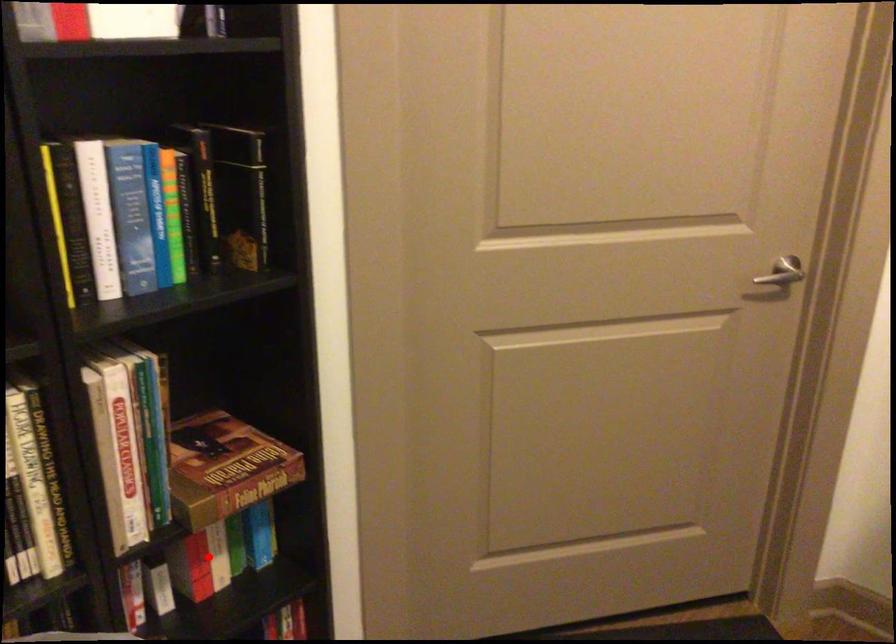
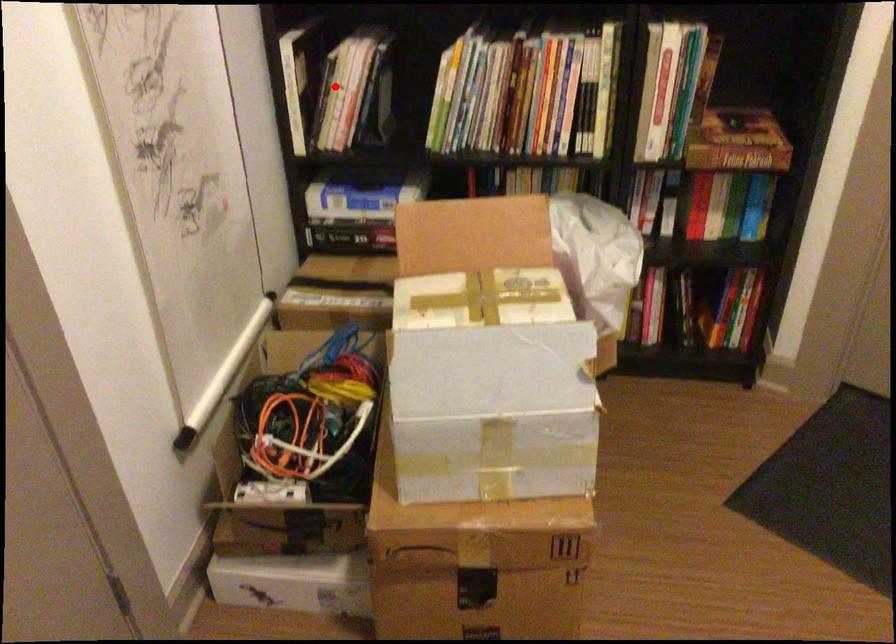
I am providing you with two images of the same scene from different viewpoints. A red point is marked on the first image and another point is marked on the second image. Is the red point in image1 aligned with the point shown in image2?

No